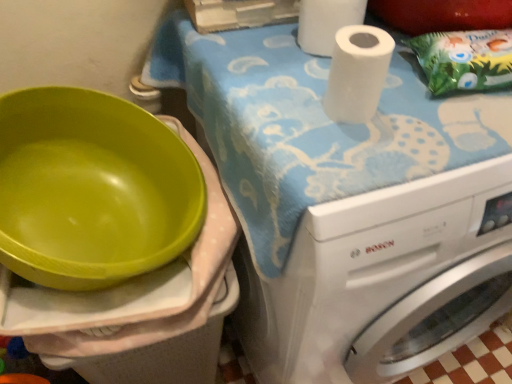
Find the location of `vacant space positioned to the left of white matte paper towel at upper center, placed as the 1th paper towel when sorted from front to back`. vacant space positioned to the left of white matte paper towel at upper center, placed as the 1th paper towel when sorted from front to back is located at coordinates (271, 96).